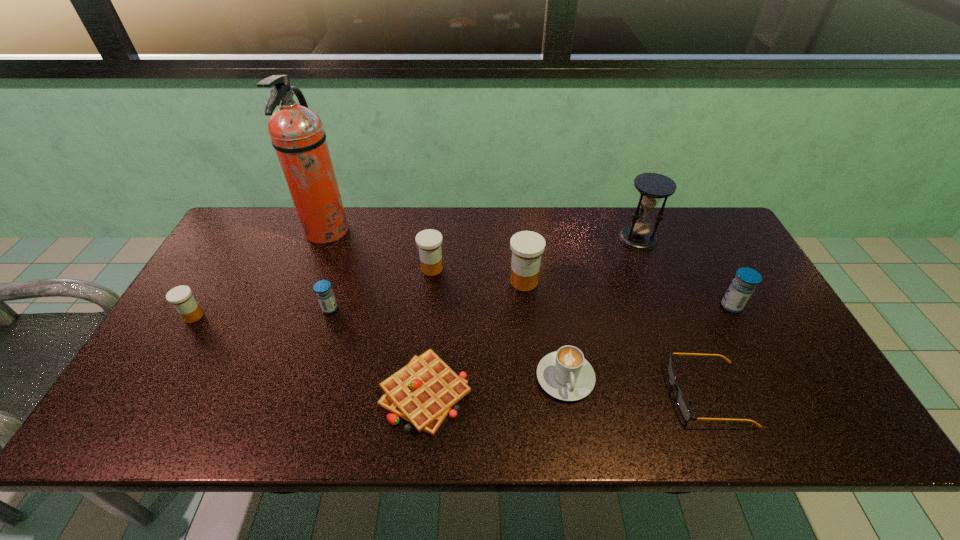
You are a GUI agent. You are given a task and a screenshot of the screen. Output one action in this format:
    pyautogui.click(x=<x>, y=<y>)
    Task: Click on the smaller blue medicine
    This screenshot has height=540, width=960.
    Given the screenshot: What is the action you would take?
    pyautogui.click(x=322, y=288)

You are a GUI agent. You are given a task and a screenshot of the screen. Output one action in this format:
    pyautogui.click(x=<x>, y=<y>)
    Task: Click on the leftmost orange medicine
    
    Given the screenshot: What is the action you would take?
    pyautogui.click(x=181, y=297)

At what (x,y) coordinates should I click in order to perform the action: click on the nearest orange medicine. Please return your answer as a coordinate pair (x, y). The width and height of the screenshot is (960, 540). Looking at the image, I should click on (181, 297).

Find the location of a particular element. cappuccino is located at coordinates (565, 374).

The width and height of the screenshot is (960, 540). I want to click on spectacles, so click(681, 402).

Find the location of `waffle`. waffle is located at coordinates (423, 392).

The image size is (960, 540). I want to click on vacant space situated 0.250m at the nozzle of the tallest object, so click(x=424, y=232).

The image size is (960, 540). In order to click on vacant space situated on the front of the hourglass in this screenshot , I will do `click(666, 312)`.

The image size is (960, 540). I want to click on free location located 0.130m on the label of the third tallest object, so click(463, 281).

Identify the location of vacant space situated on the label of the third tallest object. The image size is (960, 540). (436, 281).